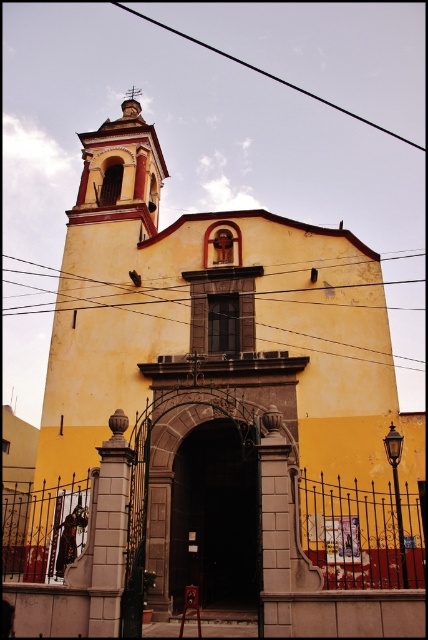
You are standing in front of the yellow church and notice two wires running across the facade. The black wire at upper center and the metallic wire at center. Which wire is positioned higher up on the church facade?

The black wire at upper center is positioned higher up on the church facade than the metallic wire at center.

You are standing in front of the yellow church and notice two wires. The black wire at upper center and the metallic wire at center. Which wire is positioned to the right side of the other?

The black wire at upper center is to the right of the metallic wire at center.